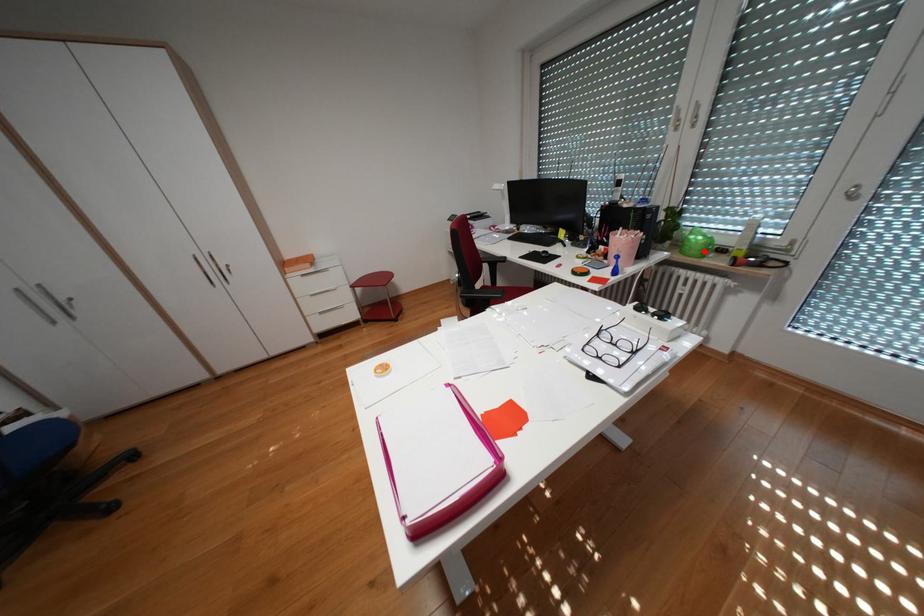
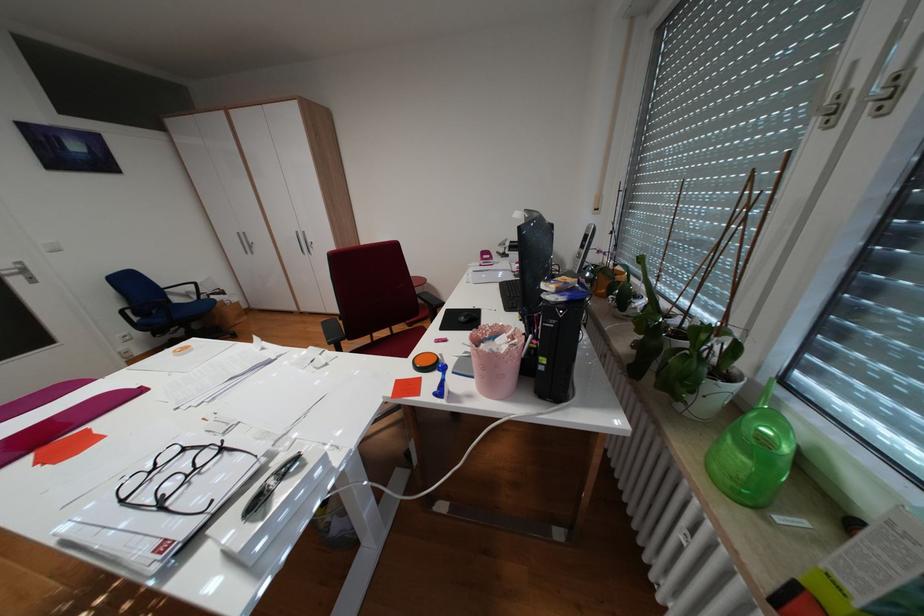
Locate, in the second image, the point that corresponds to the highlighted location in the first image.

(727, 466)